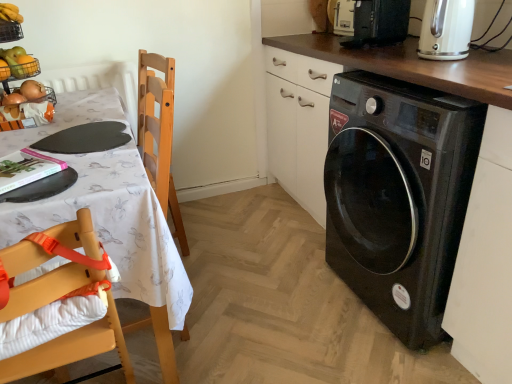
Identify the location of vacant space to the right of white fabric tablecloth at left. The width and height of the screenshot is (512, 384). (268, 296).